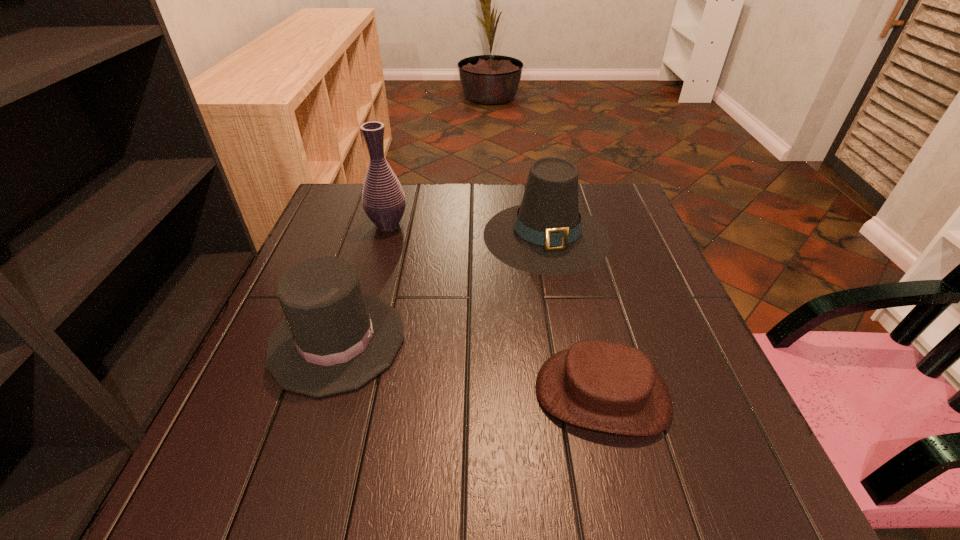
The width and height of the screenshot is (960, 540). Find the location of `hat situated at the far edge`. hat situated at the far edge is located at coordinates (547, 234).

Find the location of `vase at the left edge`. vase at the left edge is located at coordinates pos(383,199).

Locate an element on the screen. dress hat at the left edge is located at coordinates (334, 339).

Locate an element on the screen. The width and height of the screenshot is (960, 540). object that is at the far left corner is located at coordinates (383, 199).

Where is `object situated at the far right corner`? object situated at the far right corner is located at coordinates (547, 234).

In the image, there is a desktop. At what (x,y) coordinates should I click in order to perform the action: click on vacant region at the far edge. Please return your answer as a coordinate pair (x, y). Looking at the image, I should click on click(x=474, y=193).

The height and width of the screenshot is (540, 960). I want to click on vacant region at the near edge of the desktop, so click(x=523, y=481).

At what (x,y) coordinates should I click in order to perform the action: click on free spot at the left edge of the desktop. Please return your answer as a coordinate pair (x, y). Looking at the image, I should click on (353, 242).

Where is `free space at the right edge of the desktop`? The height and width of the screenshot is (540, 960). free space at the right edge of the desktop is located at coordinates (676, 304).

Image resolution: width=960 pixels, height=540 pixels. Find the location of `vacant space at the far left corner of the desktop`. vacant space at the far left corner of the desktop is located at coordinates (321, 224).